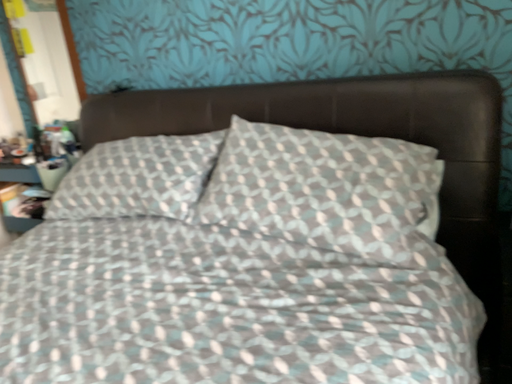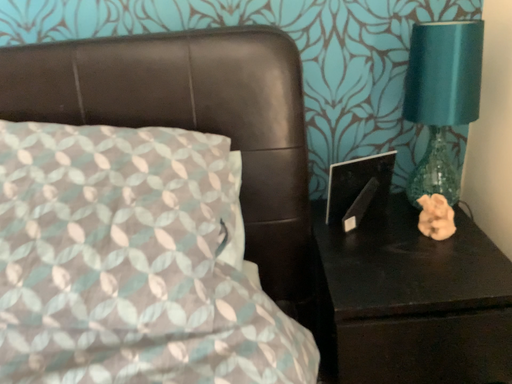
Question: Which way did the camera rotate in the video?

Choices:
 (A) rotated left
 (B) rotated right

Answer: (B)